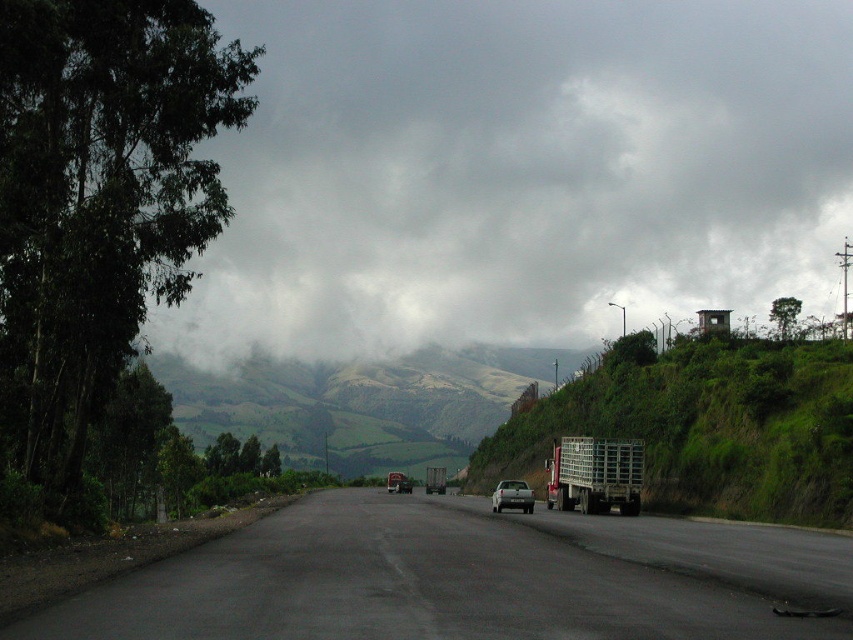
Question: Which object is farther from the camera taking this photo?

Choices:
 (A) metallic silver trailer truck at right
 (B) cloudy sky at upper center
 (C) metallic silver truck at center

Answer: (B)

Question: Which object appears farthest from the camera in this image?

Choices:
 (A) cloudy sky at upper center
 (B) metallic silver trailer truck at right
 (C) asphalt road at center
 (D) metallic silver truck at center

Answer: (A)

Question: Is silver metallic car at center thinner than metallic silver truck at center?

Choices:
 (A) yes
 (B) no

Answer: (A)

Question: Does cloudy sky at upper center appear over metallic silver trailer truck at right?

Choices:
 (A) yes
 (B) no

Answer: (A)

Question: Which object is farther from the camera taking this photo?

Choices:
 (A) cloudy sky at upper center
 (B) asphalt road at center
 (C) metallic silver trailer truck at right

Answer: (A)

Question: Is cloudy sky at upper center to the left of metallic silver trailer truck at right from the viewer's perspective?

Choices:
 (A) no
 (B) yes

Answer: (A)